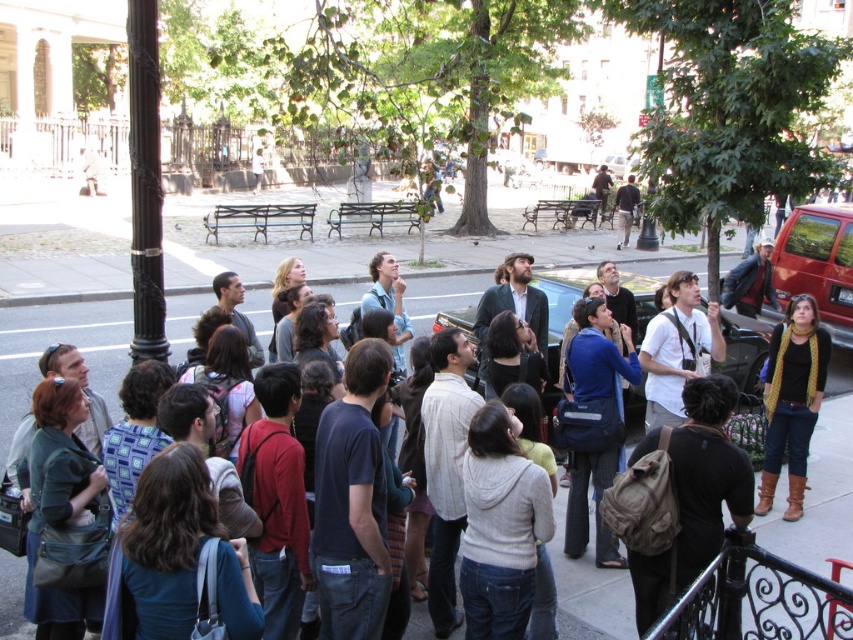
You are standing at the position of point (825, 356) and want to move to the front of the crowd. There is a point marked at (595, 620). Can you walk directly towards that point to reach the front?

Yes, you can walk directly towards point (595, 620) because it is in front of your current position at point (825, 356).

You are a tour guide leading a group on a city street. You notice the gray concrete pavement at center and the knitted yellow scarf at center. If you want to ensure all your group members can see the attraction ahead, which object should you stand closer to, and why?

You should stand closer to the gray concrete pavement at center because it is farther from the knitted yellow scarf at center by 9.34 feet, allowing you to position yourself in a central area where all group members can see the attraction without obstruction.

Looking at this image, you are a photographer trying to capture a shot of the gray concrete pavement at center and the knitted yellow scarf at center. Which object is wider in the image?

The gray concrete pavement at center is wider than the knitted yellow scarf at center according to the description.